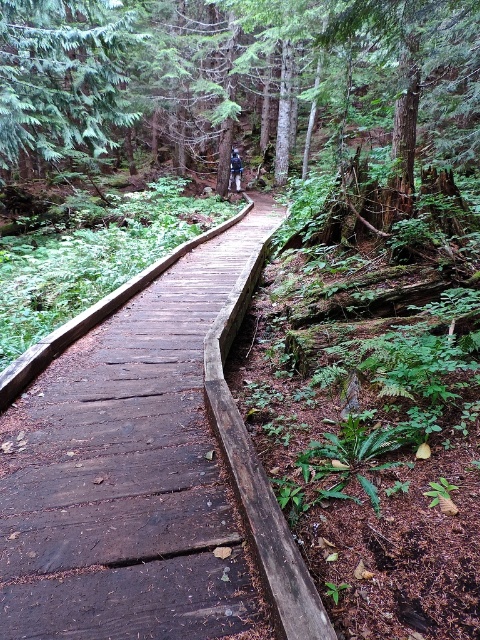
Describe the element at coordinates (145, 470) in the screenshot. I see `brown wooden boardwalk at center` at that location.

Between brown wooden boardwalk at center and green matte tree at upper left, which one is positioned lower?

brown wooden boardwalk at center is lower down.

Between point (140, 582) and point (71, 116), which one is positioned in front?

Point (140, 582) is in front.

You are a GUI agent. You are given a task and a screenshot of the screen. Output one action in this format:
    pyautogui.click(x=<x>, y=<y>)
    Task: Click on the brown wooden boardwalk at center
    
    Given the screenshot: What is the action you would take?
    pyautogui.click(x=145, y=470)